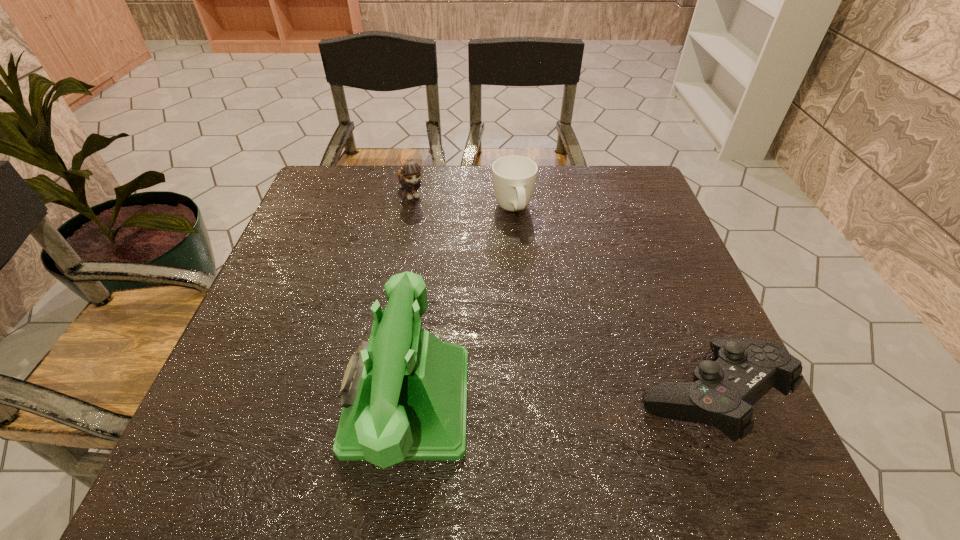
Identify the location of vacant region at the far edge of the desktop. (490, 168).

In the image, there is a desktop. At what (x,y) coordinates should I click in order to perform the action: click on free region at the near edge. Please return your answer as a coordinate pair (x, y). Looking at the image, I should click on (498, 397).

This screenshot has height=540, width=960. Identify the location of blank area at the left edge. (310, 319).

Locate an element on the screen. Image resolution: width=960 pixels, height=540 pixels. free spot at the far left corner of the desktop is located at coordinates (344, 167).

The height and width of the screenshot is (540, 960). Identify the location of vacant space at the near left corner of the desktop. (225, 409).

In the image, there is a desktop. At what (x,y) coordinates should I click in order to perform the action: click on vacant space at the far right corner. Please return your answer as a coordinate pair (x, y). The image size is (960, 540). Looking at the image, I should click on (637, 173).

The width and height of the screenshot is (960, 540). Identify the location of free spot between the rightmost object and the telephone. (556, 399).

Find the location of a particular element. The width and height of the screenshot is (960, 540). unoccupied area between the kitten and the second object from right to left is located at coordinates (463, 201).

I want to click on vacant space that is in between the second object from right to left and the tallest object, so pyautogui.click(x=460, y=306).

Find the location of a particular element. free space that is in between the cup and the telephone is located at coordinates (460, 306).